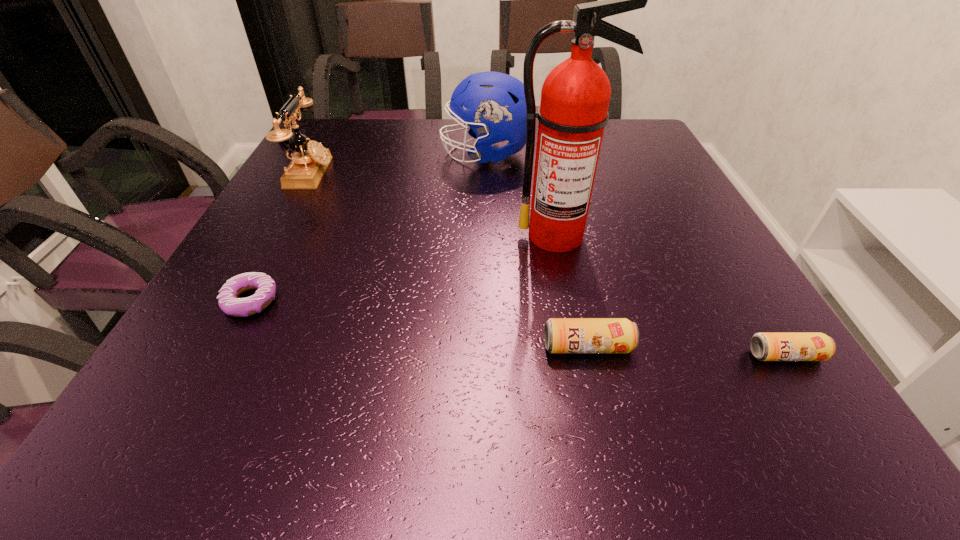
Find the location of `vacant space that's between the third nearest object and the third shortest object`. vacant space that's between the third nearest object and the third shortest object is located at coordinates (420, 324).

Find the location of `free space between the shorter beer can and the telephone`. free space between the shorter beer can and the telephone is located at coordinates (548, 265).

Image resolution: width=960 pixels, height=540 pixels. What are the coordinates of `free space between the left beer can and the doughnut` in the screenshot? It's located at (420, 324).

You are a GUI agent. You are given a task and a screenshot of the screen. Output one action in this format:
    pyautogui.click(x=<x>, y=<y>)
    Task: Click on the free space between the third farthest object and the right beer can
    
    Given the screenshot: What is the action you would take?
    pyautogui.click(x=671, y=295)

Locate an element on the screen. This screenshot has height=540, width=960. vacant space that's between the third farthest object and the left beer can is located at coordinates (572, 291).

Where is `free space between the right beer can and the tallest object`? Image resolution: width=960 pixels, height=540 pixels. free space between the right beer can and the tallest object is located at coordinates (671, 295).

I want to click on free space between the shorter beer can and the telephone, so 548,265.

Where is `free space between the telephone and the left beer can`? This screenshot has width=960, height=540. free space between the telephone and the left beer can is located at coordinates (449, 260).

You are a GUI agent. You are given a task and a screenshot of the screen. Output one action in this format:
    pyautogui.click(x=<x>, y=<y>)
    Task: Click on the vacant space that's between the telephone and the third farthest object
    
    Given the screenshot: What is the action you would take?
    pyautogui.click(x=434, y=205)

Locate an element on the screen. free space between the left beer can and the football helmet is located at coordinates (537, 251).